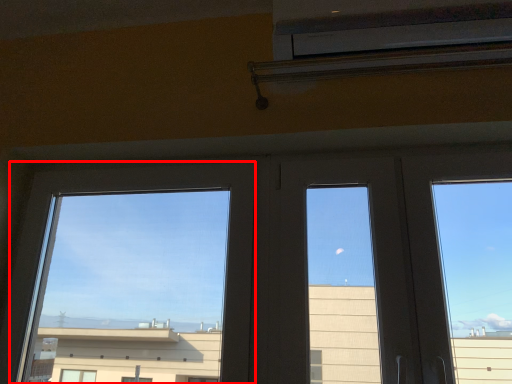
Question: Where is window (annotated by the red box) located in relation to air conditioning in the image?

Choices:
 (A) right
 (B) left

Answer: (B)